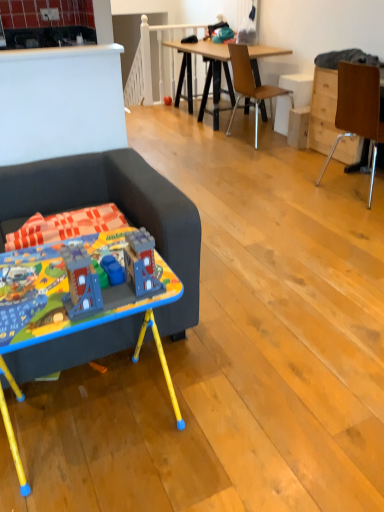
Where is `free space that is in between dark gray fabric couch at left and wooden chair at right, the 1th chair when ordered from right to left`? free space that is in between dark gray fabric couch at left and wooden chair at right, the 1th chair when ordered from right to left is located at coordinates (274, 238).